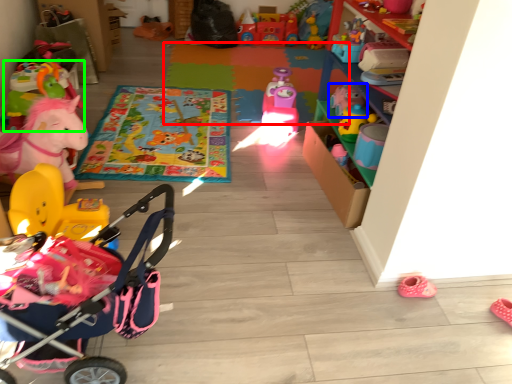
Question: Based on their relative distances, which object is nearer to mat (highlighted by a red box)? Choose from toy (highlighted by a blue box) and toy (highlighted by a green box).

Choices:
 (A) toy
 (B) toy

Answer: (A)